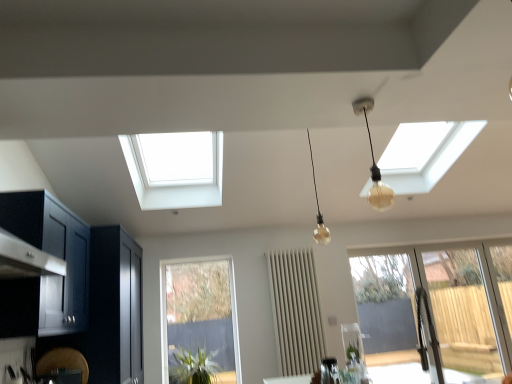
Measure the distance between clear glass window at lower center, the 1th window positioned from the left, and camera.

The depth of clear glass window at lower center, the 1th window positioned from the left, is 4.19 meters.

What do you see at coordinates (374, 163) in the screenshot?
I see `matte glass bulb at upper center, the 1th lamp positioned from the front` at bounding box center [374, 163].

At what (x,y) coordinates should I click in order to perform the action: click on matte black cabinets at left. Please return your answer as a coordinate pair (x, y). This screenshot has height=384, width=512. Looking at the image, I should click on (74, 288).

Considering the positions of objects matte glass bulb at upper center, the 1th lamp positioned from the front, and clear glass window at lower center, which is the 2th window from right to left, in the image provided, who is more to the right, matte glass bulb at upper center, the 1th lamp positioned from the front, or clear glass window at lower center, which is the 2th window from right to left,?

From the viewer's perspective, matte glass bulb at upper center, the 1th lamp positioned from the front, appears more on the right side.

From a real-world perspective, is matte glass bulb at upper center, the 1th lamp positioned from the front, above or below clear glass window at lower center, the 1th window positioned from the left?

matte glass bulb at upper center, the 1th lamp positioned from the front, is situated higher than clear glass window at lower center, the 1th window positioned from the left, in the real world.

Is matte glass bulb at upper center, the 1th lamp positioned from the front, taller or shorter than clear glass window at lower center, which is the 2th window from right to left?

Clearly, matte glass bulb at upper center, the 1th lamp positioned from the front, is shorter compared to clear glass window at lower center, which is the 2th window from right to left.

From the picture: Is matte glass bulb at upper center, which appears as the 2th lamp when viewed from the back, aimed at clear glass window at lower center, which is the 2th window from right to left?

No, matte glass bulb at upper center, which appears as the 2th lamp when viewed from the back, is not aimed at clear glass window at lower center, which is the 2th window from right to left.

From a real-world perspective, does beige fabric radiator at center stand above clear glass window at lower center, which is the 2th window from right to left?

Indeed, from a real-world perspective, beige fabric radiator at center stands above clear glass window at lower center, which is the 2th window from right to left.

Is beige fabric radiator at center bigger or smaller than clear glass window at lower center, the 1th window positioned from the left?

Clearly, beige fabric radiator at center is larger in size than clear glass window at lower center, the 1th window positioned from the left.

Can you tell me how much beige fabric radiator at center and clear glass window at lower center, which is the 2th window from right to left, differ in facing direction?

beige fabric radiator at center and clear glass window at lower center, which is the 2th window from right to left, are facing 2.29 degrees away from each other.

Is beige fabric radiator at center in front of or behind clear glass window at lower center, which is the 2th window from right to left, in the image?

In the image, beige fabric radiator at center appears in front of clear glass window at lower center, which is the 2th window from right to left.

Can we say green leafy plant at lower center lies outside beige fabric radiator at center?

That's correct, green leafy plant at lower center is outside of beige fabric radiator at center.

In the scene shown: Which object is thinner, green leafy plant at lower center or beige fabric radiator at center?

Thinner between the two is beige fabric radiator at center.

Is green leafy plant at lower center turned away from beige fabric radiator at center?

No, green leafy plant at lower center is not facing the opposite direction of beige fabric radiator at center.

Which is more to the left, green leafy plant at lower center or beige fabric radiator at center?

Positioned to the left is green leafy plant at lower center.

Is metallic silver kettle at center taller or shorter than beige fabric radiator at center?

Clearly, metallic silver kettle at center is shorter compared to beige fabric radiator at center.

Based on the photo, which object is wider, metallic silver kettle at center or beige fabric radiator at center?

beige fabric radiator at center.

Considering the relative sizes of metallic silver kettle at center and beige fabric radiator at center in the image provided, is metallic silver kettle at center bigger than beige fabric radiator at center?

Incorrect, metallic silver kettle at center is not larger than beige fabric radiator at center.

In the scene shown: From the image's perspective, relative to beige fabric radiator at center, is metallic silver kettle at center above or below?

metallic silver kettle at center is above beige fabric radiator at center.

How different are the orientations of clear glass door at lower right, which ranks as the 2th window in left-to-right order, and matte black cabinets at left in degrees?

The angle between the facing direction of clear glass door at lower right, which ranks as the 2th window in left-to-right order, and the facing direction of matte black cabinets at left is 92 degrees.

Does clear glass door at lower right, which ranks as the 2th window in left-to-right order, have a greater height compared to matte black cabinets at left?

Yes, clear glass door at lower right, which ranks as the 2th window in left-to-right order, is taller than matte black cabinets at left.

Is the depth of clear glass door at lower right, which ranks as the 2th window in left-to-right order, less than that of matte black cabinets at left?

No, it is behind matte black cabinets at left.

Does green leafy plant at lower center have a greater height compared to clear glass door at lower right, which ranks as the 2th window in left-to-right order?

No.

Does point (193, 380) come farther from viewer compared to point (462, 270)?

No.

Who is more distant, green leafy plant at lower center or clear glass door at lower right, which ranks as the 2th window in left-to-right order?

Positioned behind is clear glass door at lower right, which ranks as the 2th window in left-to-right order.

Considering the positions of objects green leafy plant at lower center and clear glass door at lower right, which ranks as the 2th window in left-to-right order, in the image provided, who is more to the right, green leafy plant at lower center or clear glass door at lower right, which ranks as the 2th window in left-to-right order,?

clear glass door at lower right, which ranks as the 2th window in left-to-right order, is more to the right.

Which of these two, matte black cabinets at left or green leafy plant at lower center, stands shorter?

green leafy plant at lower center.

Looking at the image, does matte black cabinets at left seem bigger or smaller compared to green leafy plant at lower center?

Considering their sizes, matte black cabinets at left takes up more space than green leafy plant at lower center.

In order to click on plant behind the matte black cabinets at left in this screenshot , I will do `click(194, 366)`.

Can you tell me how much matte black cabinets at left and green leafy plant at lower center differ in facing direction?

There is a 90.2-degree angle between the facing directions of matte black cabinets at left and green leafy plant at lower center.

The height and width of the screenshot is (384, 512). I want to click on lamp that is the 2nd object located in front of the clear glass window at lower center, the 1th window positioned from the left, so click(x=374, y=163).

You are a GUI agent. You are given a task and a screenshot of the screen. Output one action in this format:
    pyautogui.click(x=<x>, y=<y>)
    Task: Click on the curtain located on the right of clear glass window at lower center, which is the 2th window from right to left
    
    Given the screenshot: What is the action you would take?
    pyautogui.click(x=296, y=311)

Considering their positions, is beige fabric radiator at center positioned further to green leafy plant at lower center than metallic silver kettle at center?

metallic silver kettle at center is positioned further to the anchor green leafy plant at lower center.

Considering their positions, is matte black cabinets at left positioned closer to matte glass bulb at upper center, the 1th lamp positioned from the front, than clear glass door at lower right, marked as the first window in a right-to-left arrangement?

clear glass door at lower right, marked as the first window in a right-to-left arrangement, is positioned closer to the anchor matte glass bulb at upper center, the 1th lamp positioned from the front.

Based on their spatial positions, is matte black cabinets at left or metallic silver kettle at center further from clear glass door at lower right, which ranks as the 2th window in left-to-right order?

Among the two, matte black cabinets at left is located further to clear glass door at lower right, which ranks as the 2th window in left-to-right order.

Based on their spatial positions, is metallic silver kettle at center or matte glass bulb at upper center, the 1th lamp positioned from the front, further from clear glass window at lower center, which is the 2th window from right to left?

Among the two, matte glass bulb at upper center, the 1th lamp positioned from the front, is located further to clear glass window at lower center, which is the 2th window from right to left.

Based on their spatial positions, is clear glass window at lower center, which is the 2th window from right to left, or green leafy plant at lower center further from matte black cabinets at left?

The object further to matte black cabinets at left is green leafy plant at lower center.

Estimate the real-world distances between objects in this image. Which object is closer to clear glass window at lower center, which is the 2th window from right to left, matte glass bulb at center, acting as the 1th lamp starting from the back, or green leafy plant at lower center?

green leafy plant at lower center is positioned closer to the anchor clear glass window at lower center, which is the 2th window from right to left.

Estimate the real-world distances between objects in this image. Which object is further from matte black cabinets at left, green leafy plant at lower center or metallic silver kettle at center?

metallic silver kettle at center is positioned further to the anchor matte black cabinets at left.

Considering their positions, is green leafy plant at lower center positioned closer to metallic silver kettle at center than matte glass bulb at center, which appears as the second lamp when viewed from the front?

green leafy plant at lower center is positioned closer to the anchor metallic silver kettle at center.

Find the location of a particular element. The height and width of the screenshot is (384, 512). cabinetry between metallic silver kettle at center and clear glass window at lower center, the 1th window positioned from the left, in the front-back direction is located at coordinates (74, 288).

In order to click on lamp located between metallic silver kettle at center and beige fabric radiator at center in the depth direction in this screenshot , I will do `click(318, 209)`.

The image size is (512, 384). What are the coordinates of `curtain positioned between matte glass bulb at upper center, the 1th lamp positioned from the front, and clear glass window at lower center, the 1th window positioned from the left, from near to far` in the screenshot? It's located at (296, 311).

The height and width of the screenshot is (384, 512). I want to click on curtain located between matte black cabinets at left and clear glass door at lower right, marked as the first window in a right-to-left arrangement, in the left-right direction, so click(296, 311).